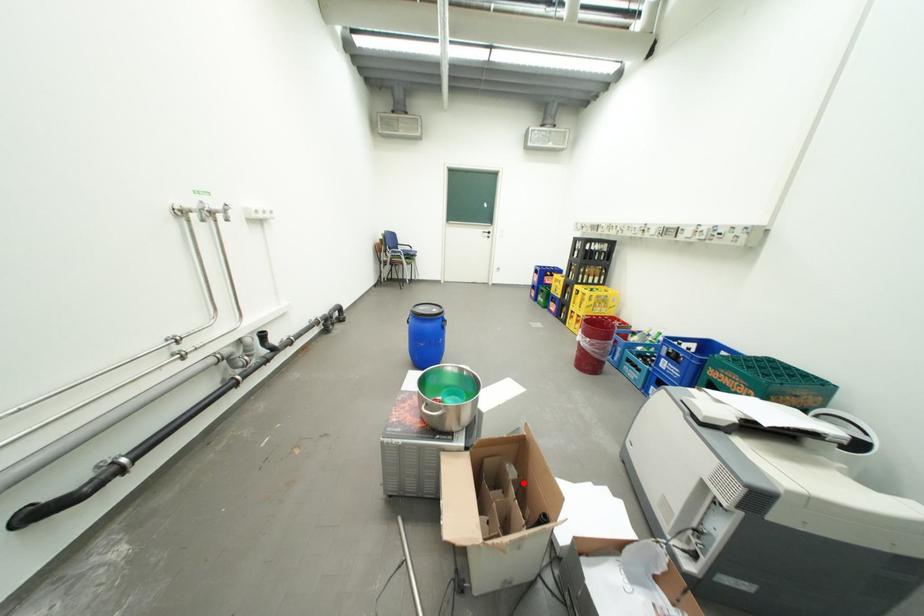
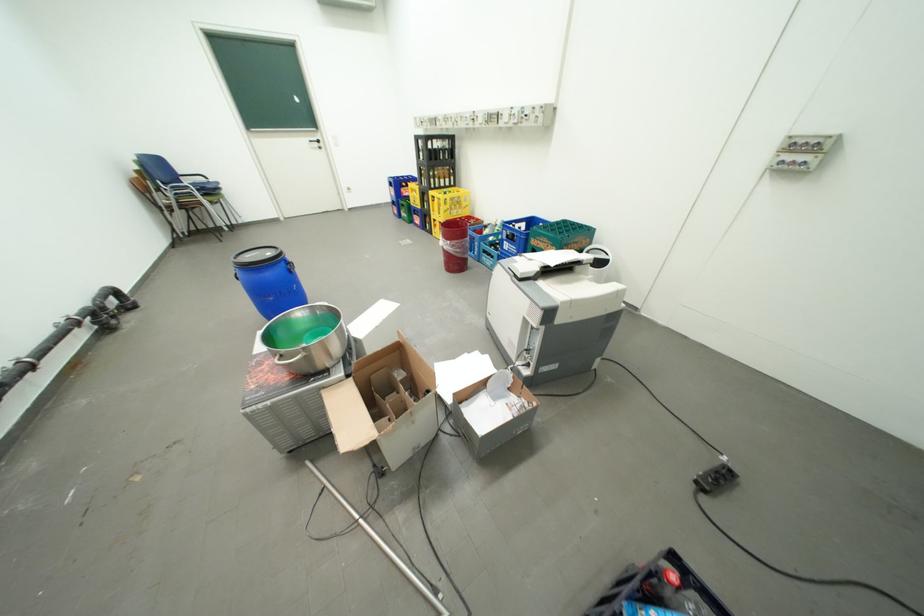
Question: I am providing you with two images of the same scene from different viewpoints. Given a red point in image1, look at the same physical point in image2. Is it:

Choices:
 (A) Closer to the viewpoint
 (B) Farther from the viewpoint

Answer: (B)